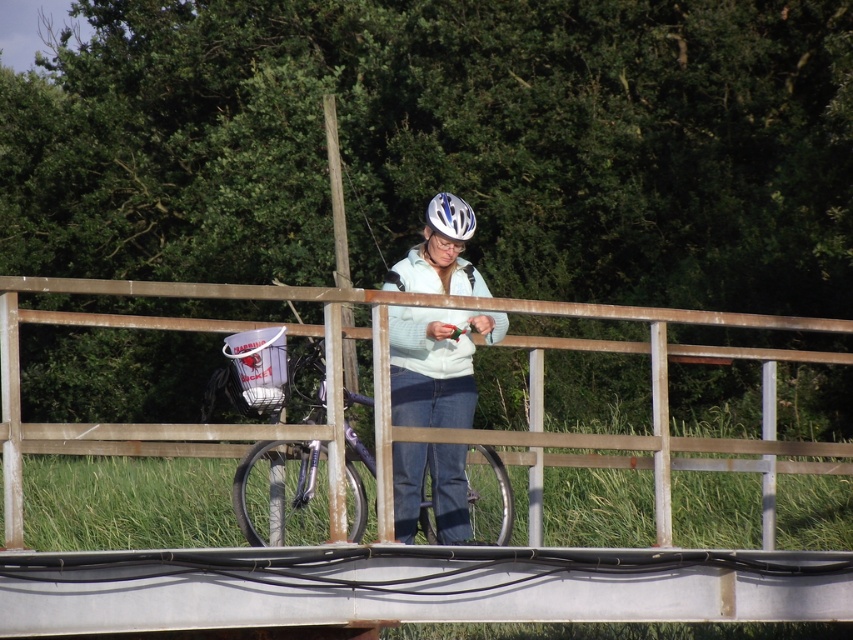
Can you confirm if white matte helmet at center is bigger than metallic purple bicycle at center?

No, white matte helmet at center is not bigger than metallic purple bicycle at center.

Is point (476, 284) in front of point (492, 474)?

Yes, it is in front of point (492, 474).

Is point (479, 541) closer to viewer compared to point (489, 524)?

That is True.

Where is `white matte helmet at center`? white matte helmet at center is located at coordinates (434, 364).

Where is `brown wooden rail at center`? The height and width of the screenshot is (640, 853). brown wooden rail at center is located at coordinates (387, 380).

This screenshot has width=853, height=640. What are the coordinates of `brown wooden rail at center` in the screenshot? It's located at (387, 380).

This screenshot has width=853, height=640. What are the coordinates of `brown wooden rail at center` in the screenshot? It's located at (387, 380).

Between brown wooden rail at center and white matte helmet at center, which one is positioned lower?

Positioned lower is white matte helmet at center.

Between brown wooden rail at center and white matte helmet at center, which one appears on the right side from the viewer's perspective?

From the viewer's perspective, brown wooden rail at center appears more on the right side.

I want to click on brown wooden rail at center, so click(x=387, y=380).